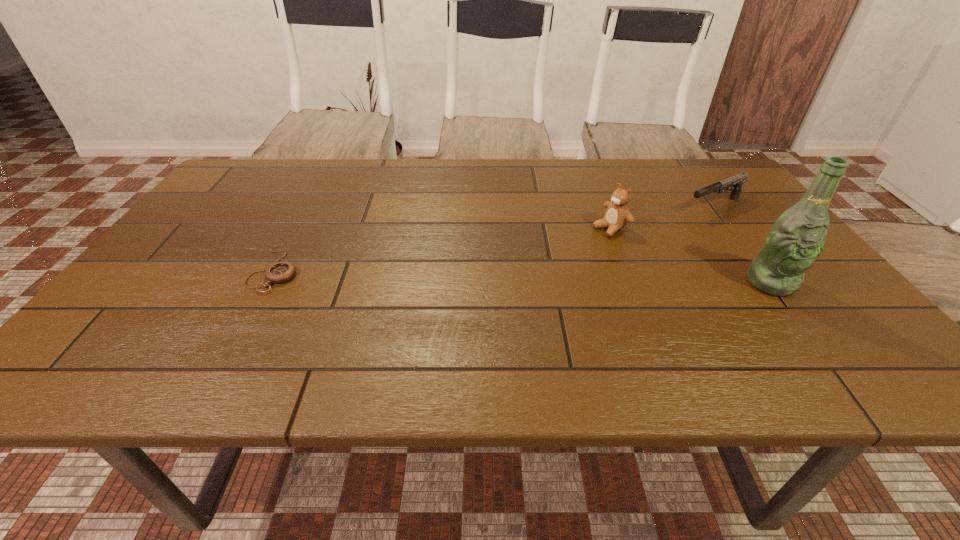
This screenshot has height=540, width=960. Identify the location of the leftmost object. (279, 272).

The width and height of the screenshot is (960, 540). What are the coordinates of `pocket watch` in the screenshot? It's located at pos(279,272).

Locate an element on the screen. The height and width of the screenshot is (540, 960). beer bottle is located at coordinates (797, 237).

Find the location of a particular element. the second tallest object is located at coordinates (617, 215).

At what (x,y) coordinates should I click in order to perform the action: click on the second object from left to right. Please return your answer as a coordinate pair (x, y). Looking at the image, I should click on (617, 215).

Where is `the third tallest object`? This screenshot has height=540, width=960. the third tallest object is located at coordinates (736, 182).

What are the coordinates of `free space located 0.070m on the front of the pocket watch` in the screenshot? It's located at (250, 317).

This screenshot has width=960, height=540. Identify the location of free space located 0.110m on the surface of the beer bottle. (811, 336).

Find the location of a particular element. This screenshot has height=540, width=960. blank space located on the front-facing side of the teddy bear is located at coordinates (530, 266).

The height and width of the screenshot is (540, 960). Identify the location of vacant region located on the front-facing side of the teddy bear. (584, 240).